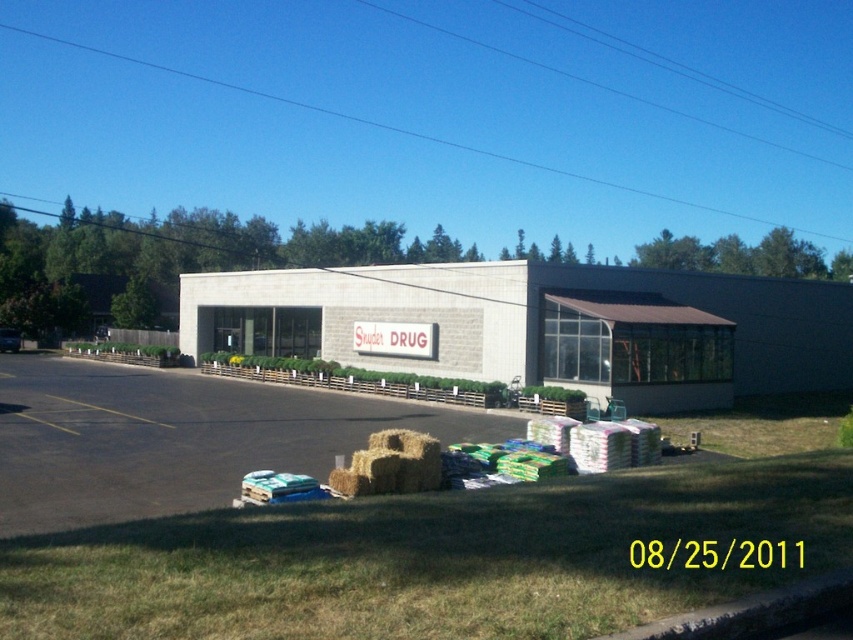
Does dark asphalt parking lot at lower left have a lesser height compared to balehayat lower center?

Yes, dark asphalt parking lot at lower left is shorter than balehayat lower center.

Who is lower down, dark asphalt parking lot at lower left or balehayat lower center?

dark asphalt parking lot at lower left is lower down.

Identify the location of dark asphalt parking lot at lower left. (173, 438).

Where is `dark asphalt parking lot at lower left`? dark asphalt parking lot at lower left is located at coordinates (173, 438).